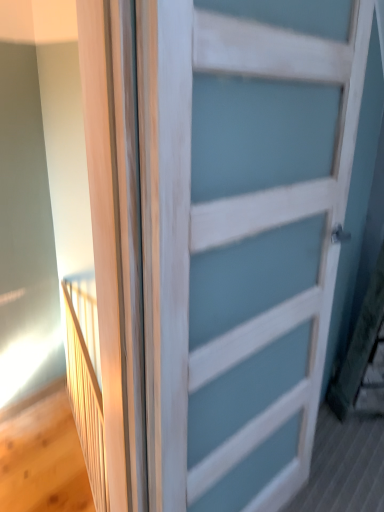
Image resolution: width=384 pixels, height=512 pixels. I want to click on white matte door at center, so click(x=240, y=245).

This screenshot has height=512, width=384. Describe the element at coordinates (240, 245) in the screenshot. I see `white matte door at center` at that location.

Locate an element on the screen. This screenshot has width=384, height=512. wooden elevator at left is located at coordinates (86, 389).

This screenshot has width=384, height=512. Describe the element at coordinates (86, 389) in the screenshot. I see `wooden elevator at left` at that location.

You are a GUI agent. You are given a task and a screenshot of the screen. Output one action in this format:
    pyautogui.click(x=<x>, y=<y>)
    Task: Click on the white matte door at center
    The width and height of the screenshot is (384, 512).
    Given the screenshot: What is the action you would take?
    pyautogui.click(x=240, y=245)

Looking at this image, considering the positions of objects wooden elevator at left and white matte door at center in the image provided, who is more to the right, wooden elevator at left or white matte door at center?

white matte door at center is more to the right.

Is wooden elevator at left positioned before white matte door at center?

No, the depth of wooden elevator at left is greater than that of white matte door at center.

Does point (98, 483) come farther from viewer compared to point (235, 93)?

Yes, point (98, 483) is farther from viewer.

From the image's perspective, which one is positioned lower, wooden elevator at left or white matte door at center?

wooden elevator at left.

From a real-world perspective, is wooden elevator at left located beneath white matte door at center?

Indeed, from a real-world perspective, wooden elevator at left is positioned beneath white matte door at center.

Considering the relative sizes of wooden elevator at left and white matte door at center in the image provided, is wooden elevator at left thinner than white matte door at center?

Correct, the width of wooden elevator at left is less than that of white matte door at center.

Considering the sizes of wooden elevator at left and white matte door at center in the image, is wooden elevator at left taller or shorter than white matte door at center?

wooden elevator at left is shorter than white matte door at center.

Is wooden elevator at left smaller than white matte door at center?

Yes, wooden elevator at left is smaller than white matte door at center.

Can we say wooden elevator at left lies outside white matte door at center?

Yes, wooden elevator at left is outside of white matte door at center.

Is wooden elevator at left next to white matte door at center and touching it?

No, wooden elevator at left is not next to white matte door at center.

Is wooden elevator at left oriented away from white matte door at center?

No, white matte door at center is not at the back of wooden elevator at left.

What's the angular difference between wooden elevator at left and white matte door at center's facing directions?

The angular difference between wooden elevator at left and white matte door at center is 114 degrees.

The width and height of the screenshot is (384, 512). I want to click on elevator on the left of white matte door at center, so click(86, 389).

Visually, is white matte door at center positioned to the left or to the right of wooden elevator at left?

From the image, it's evident that white matte door at center is to the right of wooden elevator at left.

Which object is further away from the camera, white matte door at center or wooden elevator at left?

wooden elevator at left.

Which is behind, point (258, 240) or point (66, 287)?

The point (66, 287) is behind.

From the image's perspective, is white matte door at center on top of wooden elevator at left?

Yes, from the image's perspective, white matte door at center is over wooden elevator at left.

From the picture: From a real-world perspective, is white matte door at center physically above wooden elevator at left?

Indeed, from a real-world perspective, white matte door at center stands above wooden elevator at left.

Is white matte door at center wider or thinner than wooden elevator at left?

white matte door at center is wider than wooden elevator at left.

In terms of height, does white matte door at center look taller or shorter compared to wooden elevator at left?

Clearly, white matte door at center is taller compared to wooden elevator at left.

Between white matte door at center and wooden elevator at left, which one has larger size?

white matte door at center.

Can wooden elevator at left be found inside white matte door at center?

No, wooden elevator at left is not a part of white matte door at center.

Can you see white matte door at center touching wooden elevator at left?

white matte door at center and wooden elevator at left are not in contact.

Is white matte door at center turned away from wooden elevator at left?

Yes, white matte door at center's orientation is away from wooden elevator at left.

Identify the location of elevator that is on the left side of white matte door at center. (86, 389).

Find the location of a particular element. The image size is (384, 512). elevator below the white matte door at center (from a real-world perspective) is located at coordinates (86, 389).

The image size is (384, 512). I want to click on door on the right side of wooden elevator at left, so click(240, 245).